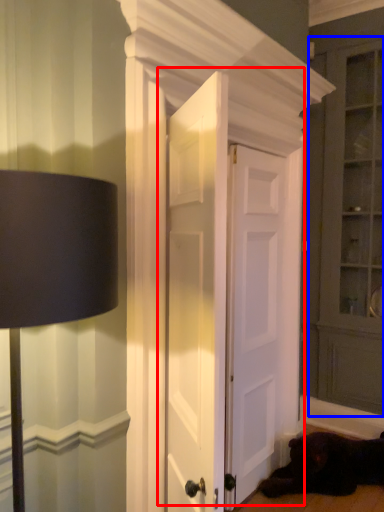
Question: Which object is closer to the camera taking this photo, door (highlighted by a red box) or dresser (highlighted by a blue box)?

Choices:
 (A) door
 (B) dresser

Answer: (A)